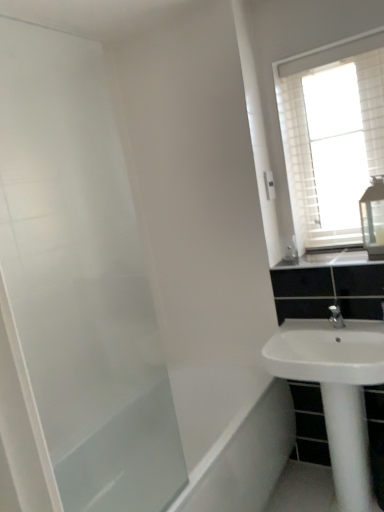
At what (x,y) coordinates should I click in order to perform the action: click on clear glass medicine cabinet at upper right. Please return your answer as a coordinate pair (x, y). The width and height of the screenshot is (384, 512). Looking at the image, I should click on (373, 218).

Which is farther, (361, 223) or (307, 258)?

Point (307, 258)

Looking at this image, is clear glass medicine cabinet at upper right positioned with its back to white glossy sink at upper right?

clear glass medicine cabinet at upper right does not have its back to white glossy sink at upper right.

How far apart are clear glass medicine cabinet at upper right and white glossy sink at upper right?

clear glass medicine cabinet at upper right is 8.50 inches from white glossy sink at upper right.

Looking at this image, is clear glass medicine cabinet at upper right located outside white glossy sink at upper right?

Yes, clear glass medicine cabinet at upper right is located beyond the bounds of white glossy sink at upper right.

From a real-world perspective, relative to transparent glass screen door at left, is clear glass medicine cabinet at upper right vertically above or below?

From a real-world perspective, clear glass medicine cabinet at upper right is physically below transparent glass screen door at left.

Do you think clear glass medicine cabinet at upper right is within transparent glass screen door at left, or outside of it?

clear glass medicine cabinet at upper right exists outside the volume of transparent glass screen door at left.

Which of these two, clear glass medicine cabinet at upper right or transparent glass screen door at left, is wider?

Wider between the two is clear glass medicine cabinet at upper right.

How distant is clear glass medicine cabinet at upper right from transparent glass screen door at left?

clear glass medicine cabinet at upper right and transparent glass screen door at left are 4.70 feet apart from each other.

How distant is white glossy sink at lower right from white textured window at upper right?

31.80 inches.

Does white glossy sink at lower right come in front of white textured window at upper right?

Yes, white glossy sink at lower right is closer to the viewer.

Considering the sizes of white glossy sink at lower right and white textured window at upper right in the image, is white glossy sink at lower right bigger or smaller than white textured window at upper right?

Clearly, white glossy sink at lower right is larger in size than white textured window at upper right.

Does white glossy sink at lower right appear on the left side of white textured window at upper right?

Yes.

This screenshot has width=384, height=512. I want to click on sink that is behind the transparent glass screen door at left, so coord(327,352).

Is transparent glass screen door at left far from white glossy sink at lower right?

They are positioned close to each other.

Considering the relative sizes of transparent glass screen door at left and white glossy sink at lower right in the image provided, is transparent glass screen door at left thinner than white glossy sink at lower right?

Correct, the width of transparent glass screen door at left is less than that of white glossy sink at lower right.

From the picture: Is white glossy sink at upper right surrounding white textured window at upper right?

No, white textured window at upper right is not inside white glossy sink at upper right.

Which object is further away from the camera, white glossy sink at upper right or white textured window at upper right?

white textured window at upper right is further away from the camera.

Is white textured window at upper right further to camera compared to white glossy sink at lower right?

Yes, it is behind white glossy sink at lower right.

Locate an element on the screen. window above the white glossy sink at lower right (from the image's perspective) is located at coordinates (332, 135).

Looking at their sizes, would you say white textured window at upper right is wider or thinner than white glossy sink at lower right?

Clearly, white textured window at upper right has less width compared to white glossy sink at lower right.

Is white textured window at upper right facing away from white glossy sink at lower right?

No, white textured window at upper right's orientation is not away from white glossy sink at lower right.

Could you tell me if transparent glass screen door at left is facing clear glass medicine cabinet at upper right?

No, transparent glass screen door at left is not oriented towards clear glass medicine cabinet at upper right.

Considering the positions of objects transparent glass screen door at left and clear glass medicine cabinet at upper right in the image provided, who is behind, transparent glass screen door at left or clear glass medicine cabinet at upper right?

clear glass medicine cabinet at upper right is further from the camera.

Between transparent glass screen door at left and clear glass medicine cabinet at upper right, which one has smaller size?

clear glass medicine cabinet at upper right is smaller.

From a real-world perspective, who is located higher, transparent glass screen door at left or clear glass medicine cabinet at upper right?

transparent glass screen door at left is physically above.

Find the location of `medicine cabinet above the white glossy sink at upper right (from a real-world perspective)`. medicine cabinet above the white glossy sink at upper right (from a real-world perspective) is located at coordinates (373, 218).

Where is `medicine cabinet on the right of transparent glass screen door at left`? medicine cabinet on the right of transparent glass screen door at left is located at coordinates (373, 218).

Based on their spatial positions, is white glossy sink at upper right or white textured window at upper right further from white glossy sink at lower right?

Among the two, white textured window at upper right is located further to white glossy sink at lower right.

In the scene shown: Estimate the real-world distances between objects in this image. Which object is closer to white glossy sink at lower right, white textured window at upper right or transparent glass screen door at left?

white textured window at upper right is closer to white glossy sink at lower right.

Estimate the real-world distances between objects in this image. Which object is closer to white glossy sink at upper right, white textured window at upper right or transparent glass screen door at left?

Among the two, white textured window at upper right is located nearer to white glossy sink at upper right.

From the picture: Which object lies nearer to the anchor point white glossy sink at upper right, transparent glass screen door at left or clear glass medicine cabinet at upper right?

Based on the image, clear glass medicine cabinet at upper right appears to be nearer to white glossy sink at upper right.

From the image, which object appears to be farther from white textured window at upper right, transparent glass screen door at left or white glossy sink at lower right?

Based on the image, transparent glass screen door at left appears to be further to white textured window at upper right.

Considering their positions, is white glossy sink at lower right positioned closer to white textured window at upper right than clear glass medicine cabinet at upper right?

clear glass medicine cabinet at upper right is positioned closer to the anchor white textured window at upper right.

Which object lies further to the anchor point transparent glass screen door at left, white glossy sink at lower right or clear glass medicine cabinet at upper right?

clear glass medicine cabinet at upper right.

Which object lies nearer to the anchor point transparent glass screen door at left, white glossy sink at upper right or white glossy sink at lower right?

white glossy sink at lower right lies closer to transparent glass screen door at left than the other object.

Identify the location of medicine cabinet between white textured window at upper right and white glossy sink at lower right in the up-down direction. (373, 218).

Identify the location of counter top between clear glass medicine cabinet at upper right and white glossy sink at lower right in the vertical direction. The height and width of the screenshot is (512, 384). (329, 260).

In order to click on sink located between transparent glass screen door at left and clear glass medicine cabinet at upper right in the left-right direction in this screenshot , I will do `click(327, 352)`.

Locate an element on the screen. Image resolution: width=384 pixels, height=512 pixels. counter top between transparent glass screen door at left and clear glass medicine cabinet at upper right in the front-back direction is located at coordinates (329, 260).